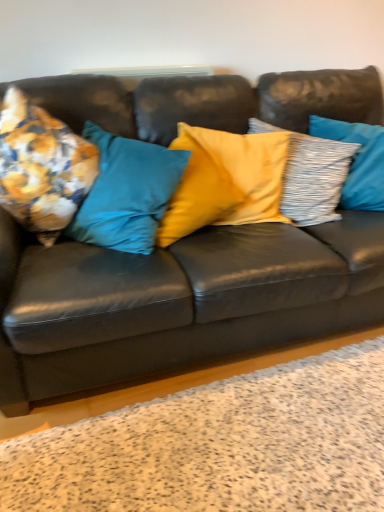
Question: Are matte black couch at center and textured gray pillow at right, marked as the first pillow in a right-to-left arrangement, located far from each other?

Choices:
 (A) no
 (B) yes

Answer: (A)

Question: Does matte black couch at center lie behind textured gray pillow at right, the fourth pillow positioned from the left?

Choices:
 (A) no
 (B) yes

Answer: (A)

Question: From the image's perspective, would you say matte black couch at center is positioned over textured gray pillow at right, marked as the first pillow in a right-to-left arrangement?

Choices:
 (A) no
 (B) yes

Answer: (A)

Question: Considering the relative sizes of matte black couch at center and textured gray pillow at right, the fourth pillow positioned from the left, in the image provided, is matte black couch at center bigger than textured gray pillow at right, the fourth pillow positioned from the left,?

Choices:
 (A) yes
 (B) no

Answer: (A)

Question: Is matte black couch at center facing away from textured gray pillow at right, the fourth pillow positioned from the left?

Choices:
 (A) no
 (B) yes

Answer: (B)

Question: Considering the positions of matte black couch at center and floral fabric cushion at left, which ranks as the 4th pillow in right-to-left order, in the image, is matte black couch at center bigger or smaller than floral fabric cushion at left, which ranks as the 4th pillow in right-to-left order,?

Choices:
 (A) big
 (B) small

Answer: (A)

Question: From a real-world perspective, is matte black couch at center physically located above or below floral fabric cushion at left, which ranks as the 4th pillow in right-to-left order?

Choices:
 (A) below
 (B) above

Answer: (A)

Question: From the image's perspective, is matte black couch at center positioned above or below floral fabric cushion at left, which is counted as the first pillow, starting from the left?

Choices:
 (A) above
 (B) below

Answer: (B)

Question: Considering the positions of point (284, 96) and point (48, 155), is point (284, 96) closer or farther from the camera than point (48, 155)?

Choices:
 (A) closer
 (B) farther

Answer: (B)

Question: In the image, is textured gray pillow at right, the fourth pillow positioned from the left, on the left side or the right side of matte black couch at center?

Choices:
 (A) right
 (B) left

Answer: (A)

Question: Is point [x=362, y=201] positioned closer to the camera than point [x=200, y=253]?

Choices:
 (A) farther
 (B) closer

Answer: (A)

Question: Considering their positions, is textured gray pillow at right, marked as the first pillow in a right-to-left arrangement, located in front of or behind matte black couch at center?

Choices:
 (A) front
 (B) behind

Answer: (B)

Question: Is textured gray pillow at right, the fourth pillow positioned from the left, taller or shorter than matte black couch at center?

Choices:
 (A) short
 (B) tall

Answer: (A)

Question: From the image's perspective, relative to yellow satin pillow at center, the second pillow positioned from the right, is matte black couch at center above or below?

Choices:
 (A) below
 (B) above

Answer: (A)

Question: Is matte black couch at center inside or outside of yellow satin pillow at center, arranged as the 3th pillow when viewed from the left?

Choices:
 (A) outside
 (B) inside

Answer: (A)